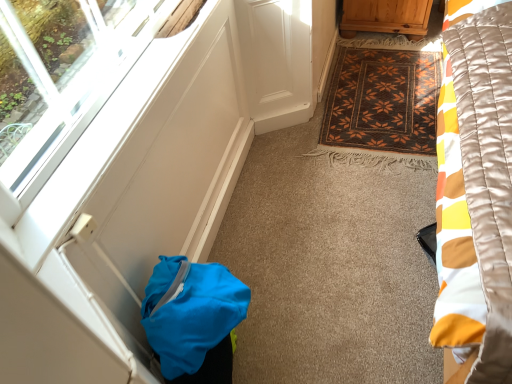
The image size is (512, 384). Find the location of `vacant space in brown woven mat at center (from a real-world perspective)`. vacant space in brown woven mat at center (from a real-world perspective) is located at coordinates (372, 96).